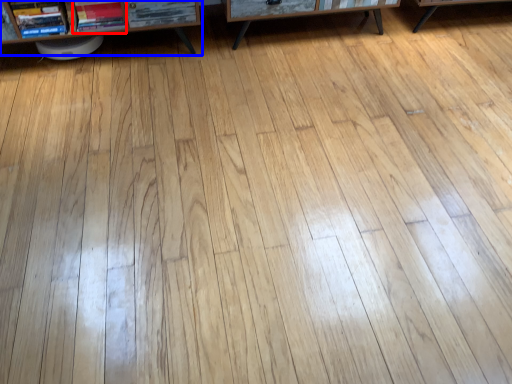
Question: Which object appears closest to the camera in this image, book (highlighted by a red box) or shelf (highlighted by a blue box)?

Choices:
 (A) book
 (B) shelf

Answer: (B)